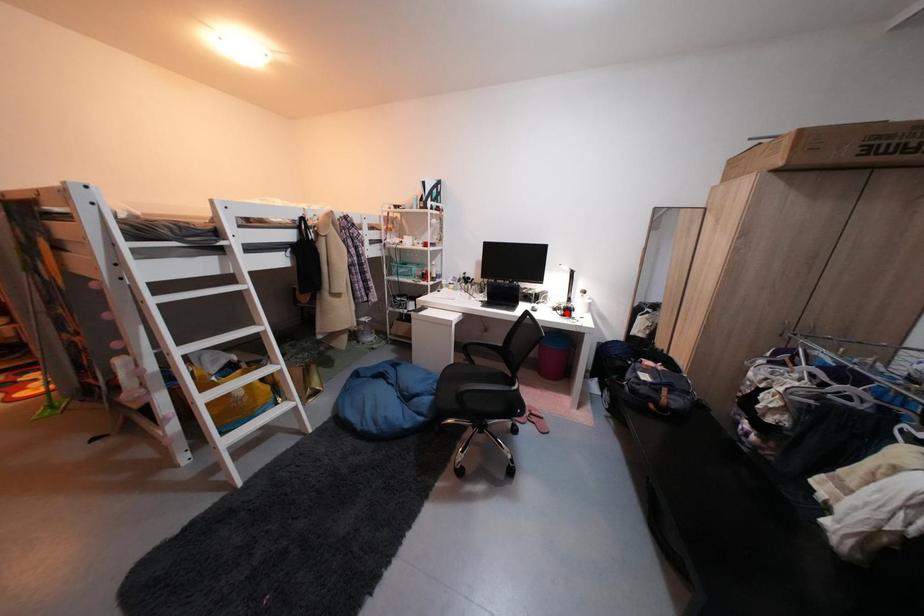
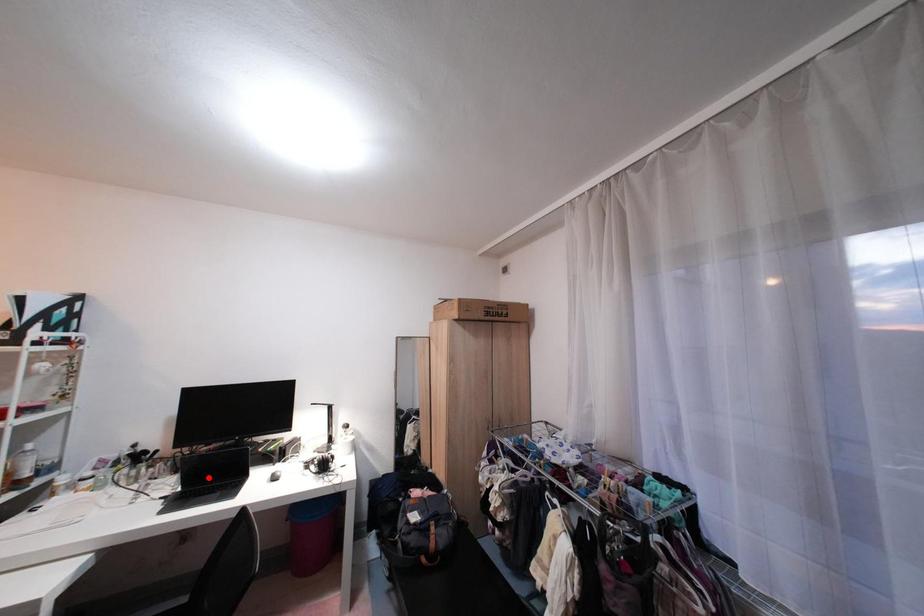
I am providing you with two images of the same scene from different viewpoints. A red point is marked on the first image and another point is marked on the second image. Is the red point in image1 aligned with the point shown in image2?

No